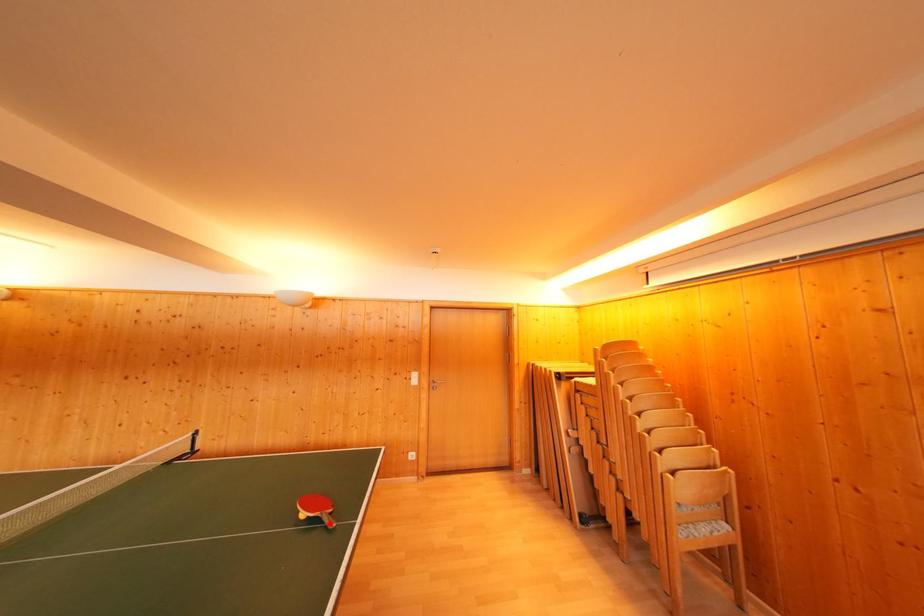
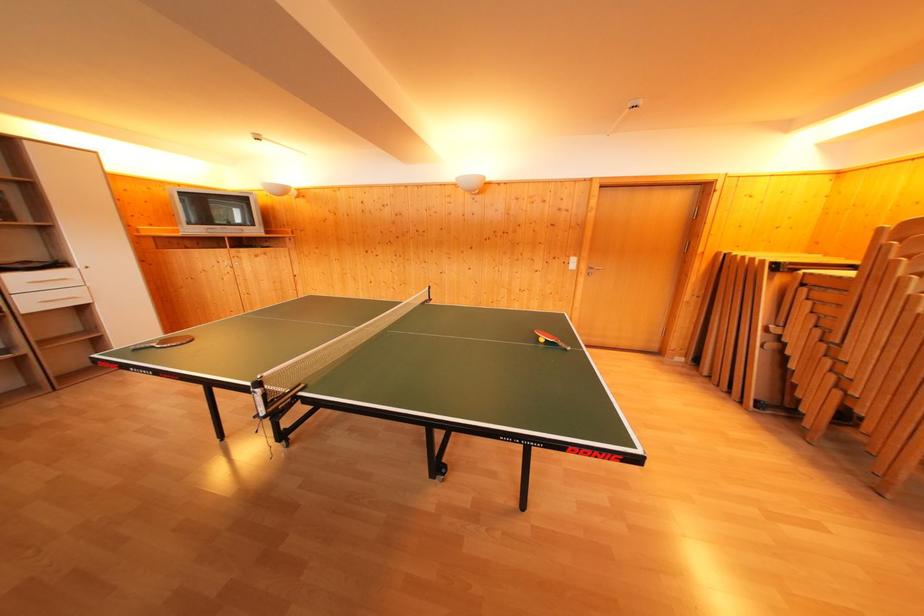
Where in the second image is the point corresponding to the highlighted location from the first image?

(565, 350)